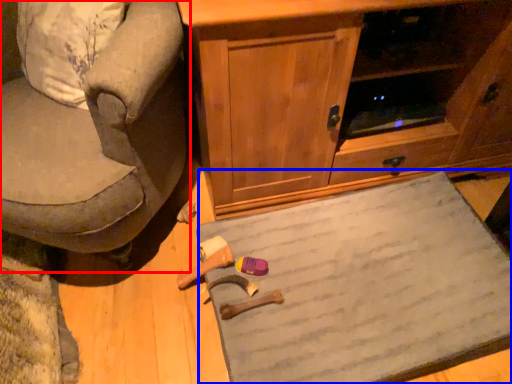
Question: Among these objects, which one is nearest to the camera, chair (highlighted by a red box) or doormat (highlighted by a blue box)?

Choices:
 (A) chair
 (B) doormat

Answer: (A)